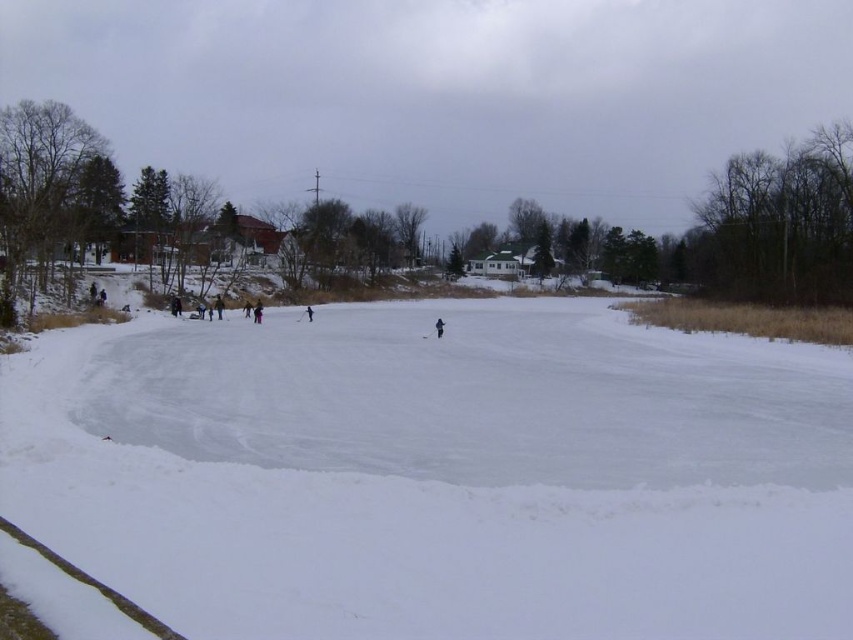
The width and height of the screenshot is (853, 640). I want to click on black snowsuit at center, so click(x=257, y=310).

Does black snowsuit at center have a smaller size compared to black matte skier at center?

Incorrect, black snowsuit at center is not smaller in size than black matte skier at center.

Which is in front, point (254, 307) or point (440, 326)?

Point (440, 326) is in front.

Where is `black snowsuit at center`? Image resolution: width=853 pixels, height=640 pixels. black snowsuit at center is located at coordinates click(x=257, y=310).

Can you confirm if dark blue jacket at center is positioned above black snowsuit at center?

Correct, dark blue jacket at center is located above black snowsuit at center.

Which is more to the right, dark blue jacket at center or black snowsuit at center?

black snowsuit at center

Identify the location of dark blue jacket at center. The width and height of the screenshot is (853, 640). (218, 307).

Is dark blue jacket at center thinner than black matte skier at center?

No, dark blue jacket at center is not thinner than black matte skier at center.

Does point (219, 296) come closer to viewer compared to point (439, 323)?

No, it is behind (439, 323).

You are a GUI agent. You are given a task and a screenshot of the screen. Output one action in this format:
    pyautogui.click(x=<x>, y=<y>)
    Task: Click on the dark blue jacket at center
    
    Given the screenshot: What is the action you would take?
    pyautogui.click(x=218, y=307)